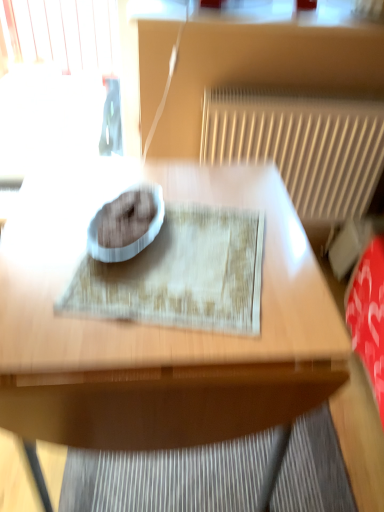
In order to click on vacant space situated on the left part of textured beige mat at center in this screenshot , I will do `click(42, 241)`.